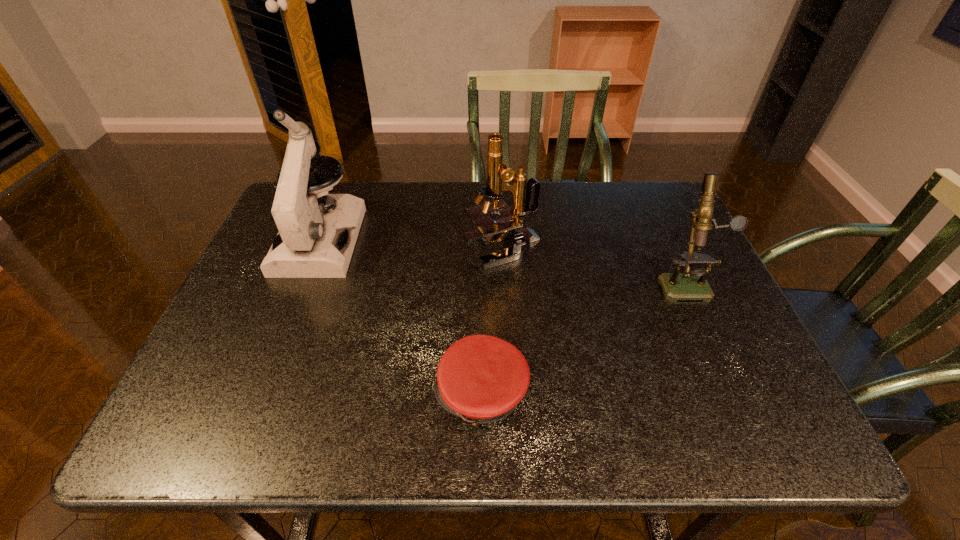
I want to click on blank area at the left edge, so click(x=299, y=301).

Find the location of a particular element. This screenshot has width=960, height=540. free space at the right edge is located at coordinates (755, 368).

In the image, there is a desktop. Identify the location of vacant space at the near left corner. The width and height of the screenshot is (960, 540). (234, 447).

Identify the location of vacant space at the far right corner of the desktop. The height and width of the screenshot is (540, 960). (678, 213).

The image size is (960, 540). What are the coordinates of `unoccupied position between the leftmost object and the second microscope from right to left` in the screenshot? It's located at (412, 244).

Locate an element on the screen. free area in between the shortest object and the rightmost object is located at coordinates (583, 337).

At what (x,y) coordinates should I click in order to perform the action: click on vacant point located between the second microscope from right to left and the third tallest object. Please return your answer as a coordinate pair (x, y). Looking at the image, I should click on (594, 264).

The height and width of the screenshot is (540, 960). I want to click on vacant space that is in between the cap and the leftmost object, so click(400, 316).

Locate an element on the screen. The image size is (960, 540). free spot between the rightmost object and the nearest object is located at coordinates (583, 337).

Where is `free space between the second shortest object and the nearest object`? The width and height of the screenshot is (960, 540). free space between the second shortest object and the nearest object is located at coordinates (583, 337).